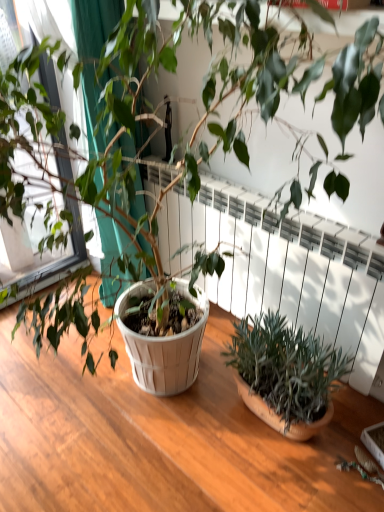
Question: From the image's perspective, is green fabric at left above or below green matte plant at lower right?

Choices:
 (A) below
 (B) above

Answer: (B)

Question: Considering the positions of green fabric at left and green matte plant at lower right in the image, is green fabric at left taller or shorter than green matte plant at lower right?

Choices:
 (A) tall
 (B) short

Answer: (A)

Question: Which object is positioned closest to the white textured radiator at center?

Choices:
 (A) green fabric at left
 (B) green matte plant at lower right

Answer: (B)

Question: Considering the real-world distances, which object is farthest from the white textured radiator at center?

Choices:
 (A) green fabric at left
 (B) green matte plant at lower right

Answer: (A)